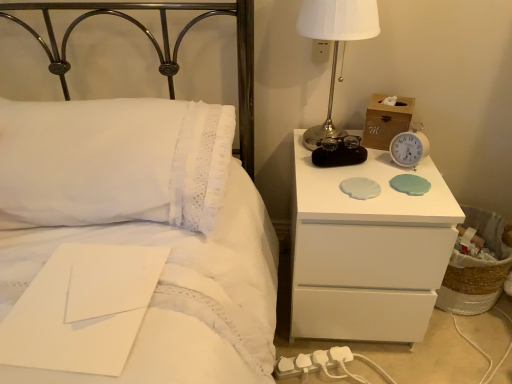
Question: Is white lace pillow at upper left wider or thinner than silver metallic bedside lamp at upper right?

Choices:
 (A) thin
 (B) wide

Answer: (B)

Question: Relative to silver metallic bedside lamp at upper right, is white lace pillow at upper left in front or behind?

Choices:
 (A) behind
 (B) front

Answer: (B)

Question: Which is nearer to the white plastic charger at lower center?

Choices:
 (A) white lace pillow at upper left
 (B) white paper at lower left
 (C) white glossy nightstand at right
 (D) white plastic electric outlet at upper center
 (E) silver metallic bedside lamp at upper right

Answer: (C)

Question: Considering the real-world distances, which object is closest to the wooden tissue box at upper right?

Choices:
 (A) white paper at lower left
 (B) white lace pillow at upper left
 (C) woven straw basket at lower right
 (D) silver metallic bedside lamp at upper right
 (E) white lace pillow at upper left

Answer: (D)